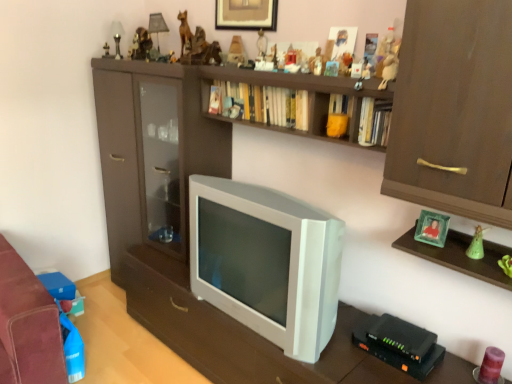
Question: Considering the relative sizes of matte brown figurine at upper center, positioned as the 5th toy in front-to-back order, and white plush toy at upper center, placed as the ninth toy when sorted from left to right, in the image provided, is matte brown figurine at upper center, positioned as the 5th toy in front-to-back order, taller than white plush toy at upper center, placed as the ninth toy when sorted from left to right,?

Choices:
 (A) no
 (B) yes

Answer: (A)

Question: Is matte brown figurine at upper center, which ranks as the 7th toy in top-to-bottom order, oriented away from white plush toy at upper center, the third toy positioned from the right?

Choices:
 (A) yes
 (B) no

Answer: (B)

Question: Can you confirm if matte brown figurine at upper center, the fifth toy positioned from the bottom, is positioned to the right of white plush toy at upper center, the 1th toy viewed from the front?

Choices:
 (A) yes
 (B) no

Answer: (B)

Question: Considering the relative positions of matte brown figurine at upper center, which ranks as the 7th toy in top-to-bottom order, and white plush toy at upper center, the ninth toy positioned from the top, in the image provided, is matte brown figurine at upper center, which ranks as the 7th toy in top-to-bottom order, to the left of white plush toy at upper center, the ninth toy positioned from the top, from the viewer's perspective?

Choices:
 (A) no
 (B) yes

Answer: (B)

Question: From a real-world perspective, is matte brown figurine at upper center, arranged as the fifth toy when viewed from the right, on top of white plush toy at upper center, the 1th toy viewed from the front?

Choices:
 (A) no
 (B) yes

Answer: (B)

Question: From the image's perspective, is matte brown figurine at upper center, the fifth toy positioned from the bottom, located beneath white plush toy at upper center, the third toy positioned from the right?

Choices:
 (A) yes
 (B) no

Answer: (B)

Question: From a real-world perspective, is hardcover book at upper center, placed as the 1th book when sorted from back to front, physically below metallic gold statue at upper center, the 10th toy ordered from the bottom?

Choices:
 (A) no
 (B) yes

Answer: (B)

Question: Considering the relative sizes of hardcover book at upper center, placed as the 1th book when sorted from back to front, and metallic gold statue at upper center, marked as the eleventh toy in a front-to-back arrangement, in the image provided, is hardcover book at upper center, placed as the 1th book when sorted from back to front, thinner than metallic gold statue at upper center, marked as the eleventh toy in a front-to-back arrangement,?

Choices:
 (A) yes
 (B) no

Answer: (B)

Question: Can you confirm if hardcover book at upper center, placed as the 1th book when sorted from back to front, is positioned to the right of metallic gold statue at upper center, acting as the first toy starting from the left?

Choices:
 (A) yes
 (B) no

Answer: (A)

Question: Is hardcover book at upper center, which is counted as the 1th book, starting from the left, next to metallic gold statue at upper center, the 10th toy ordered from the bottom?

Choices:
 (A) no
 (B) yes

Answer: (A)

Question: Considering the relative sizes of hardcover book at upper center, arranged as the third book when viewed from the front, and metallic gold statue at upper center, positioned as the 11th toy in right-to-left order, in the image provided, is hardcover book at upper center, arranged as the third book when viewed from the front, bigger than metallic gold statue at upper center, positioned as the 11th toy in right-to-left order,?

Choices:
 (A) yes
 (B) no

Answer: (A)

Question: Is hardcover book at upper center, arranged as the 3th book when viewed from the right, positioned beyond the bounds of metallic gold statue at upper center, positioned as the 11th toy in right-to-left order?

Choices:
 (A) yes
 (B) no

Answer: (A)

Question: Considering the relative positions of matte plastic pyramid at upper center, the fourth toy in the top-to-bottom sequence, and matte plastic toy at upper center, which is the 8th toy from top to bottom, in the image provided, is matte plastic pyramid at upper center, the fourth toy in the top-to-bottom sequence, to the right of matte plastic toy at upper center, which is the 8th toy from top to bottom, from the viewer's perspective?

Choices:
 (A) yes
 (B) no

Answer: (B)